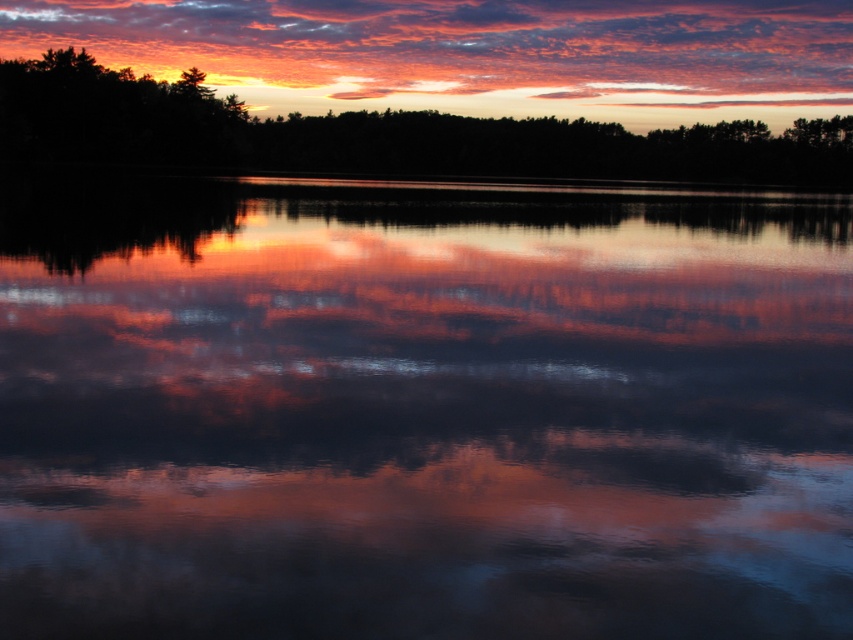
Is reflective water at center below dark green leafy trees at upper center?

Correct, reflective water at center is located below dark green leafy trees at upper center.

Locate an element on the screen. reflective water at center is located at coordinates (421, 412).

Which is behind, point (76, 548) or point (201, 10)?

Positioned behind is point (201, 10).

Which is above, reflective water at center or matte orange cloud at upper center?

matte orange cloud at upper center is higher up.

Where is `reflective water at center`? The width and height of the screenshot is (853, 640). reflective water at center is located at coordinates (421, 412).

At what (x,y) coordinates should I click in order to perform the action: click on reflective water at center. Please return your answer as a coordinate pair (x, y). Image resolution: width=853 pixels, height=640 pixels. Looking at the image, I should click on (421, 412).

Is point (273, 36) closer to viewer compared to point (788, 154)?

No, it is behind (788, 154).

Which is behind, point (370, 33) or point (445, 131)?

Point (370, 33)

The width and height of the screenshot is (853, 640). Identify the location of matte orange cloud at upper center. (473, 52).